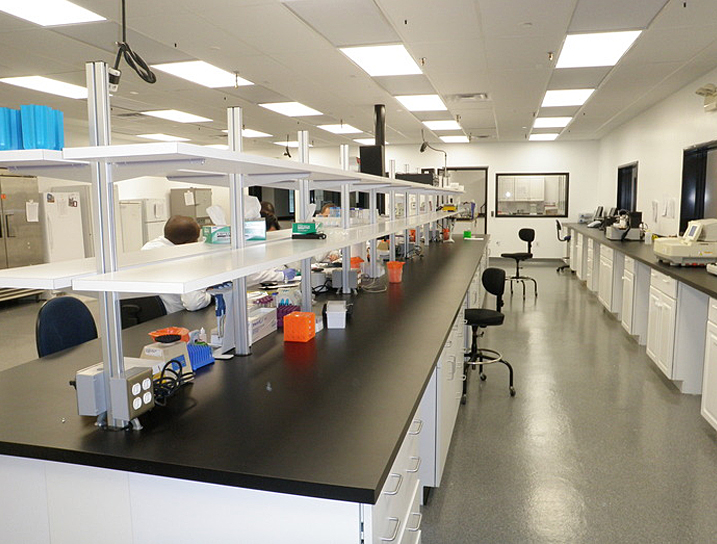
Image resolution: width=717 pixels, height=544 pixels. In order to click on countertop in this screenshot , I will do `click(417, 321)`, `click(688, 272)`, `click(135, 327)`.